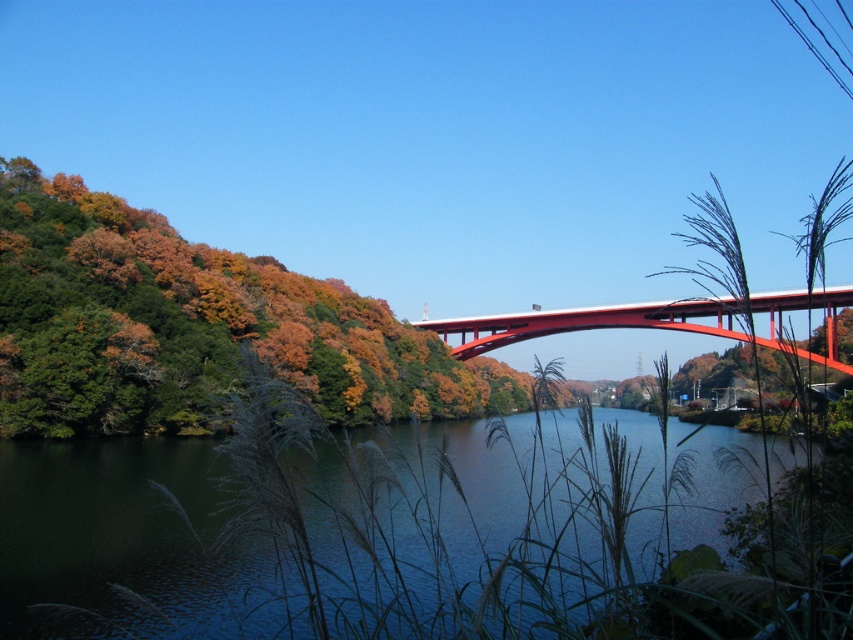
Is autumn leaves at left bigger than metallic red bridge at center?

Correct, autumn leaves at left is larger in size than metallic red bridge at center.

Is autumn leaves at left shorter than metallic red bridge at center?

Incorrect, autumn leaves at left's height does not fall short of metallic red bridge at center's.

The width and height of the screenshot is (853, 640). I want to click on autumn leaves at left, so click(x=193, y=326).

Can you confirm if dark blue water at center is thinner than autumn leaves at left?

Yes, dark blue water at center is thinner than autumn leaves at left.

Can you confirm if dark blue water at center is smaller than autumn leaves at left?

Indeed, dark blue water at center has a smaller size compared to autumn leaves at left.

This screenshot has height=640, width=853. I want to click on dark blue water at center, so click(126, 544).

This screenshot has height=640, width=853. Find the location of `dark blue water at center`. dark blue water at center is located at coordinates (126, 544).

Who is positioned more to the right, dark blue water at center or metallic red bridge at center?

From the viewer's perspective, metallic red bridge at center appears more on the right side.

Is point (198, 451) positioned in front of point (706, 333)?

That is True.

In order to click on dark blue water at center in this screenshot , I will do `click(126, 544)`.